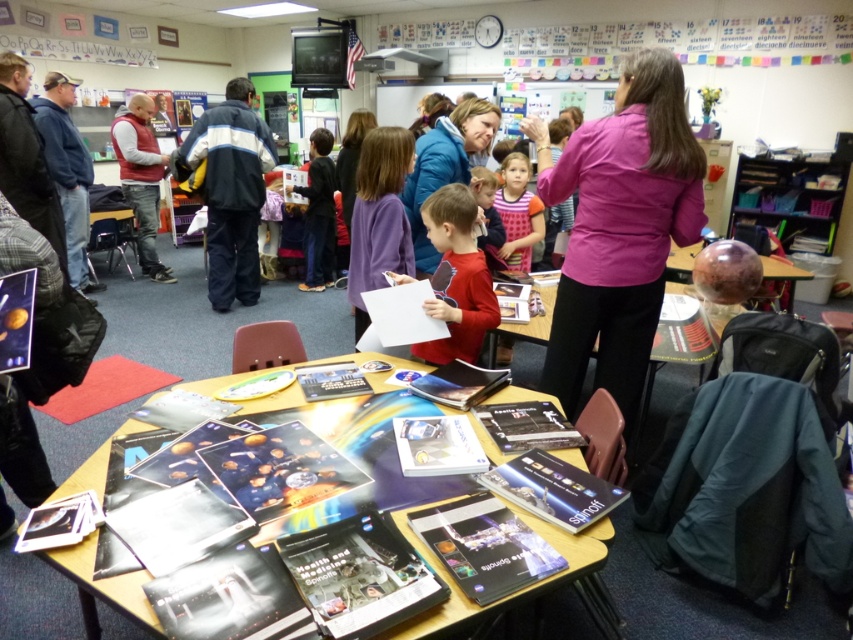
Question: Which object is the farthest from the red matte shirt at center?

Choices:
 (A) pink fabric shirt at upper center
 (B) pink dotted dress at center

Answer: (B)

Question: Does red matte shirt at center appear on the right side of pink dotted dress at center?

Choices:
 (A) no
 (B) yes

Answer: (A)

Question: Which object is the farthest from the red matte shirt at center?

Choices:
 (A) wooden table at center
 (B) matte brown vest at left

Answer: (B)

Question: Is pink fabric shirt at upper center to the left of matte brown vest at left from the viewer's perspective?

Choices:
 (A) yes
 (B) no

Answer: (B)

Question: Which of the following is the closest to the observer?

Choices:
 (A) shiny plastic table at center
 (B) wooden table at center
 (C) red matte shirt at center
 (D) pink dotted dress at center

Answer: (A)

Question: Can you confirm if shiny plastic table at center is smaller than wooden table at center?

Choices:
 (A) yes
 (B) no

Answer: (B)